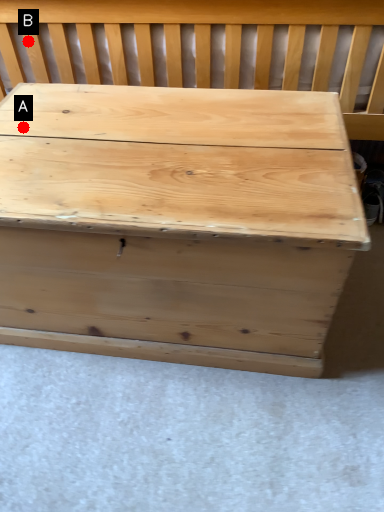
Question: Two points are circled on the image, labeled by A and B beside each circle. Among these points, which one is farthest from the camera?

Choices:
 (A) A is further
 (B) B is further

Answer: (B)